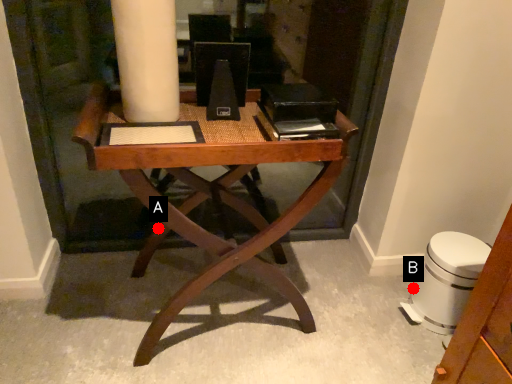
Question: Two points are circled on the image, labeled by A and B beside each circle. Which of the following is the farthest from the observer?

Choices:
 (A) A is further
 (B) B is further

Answer: (B)